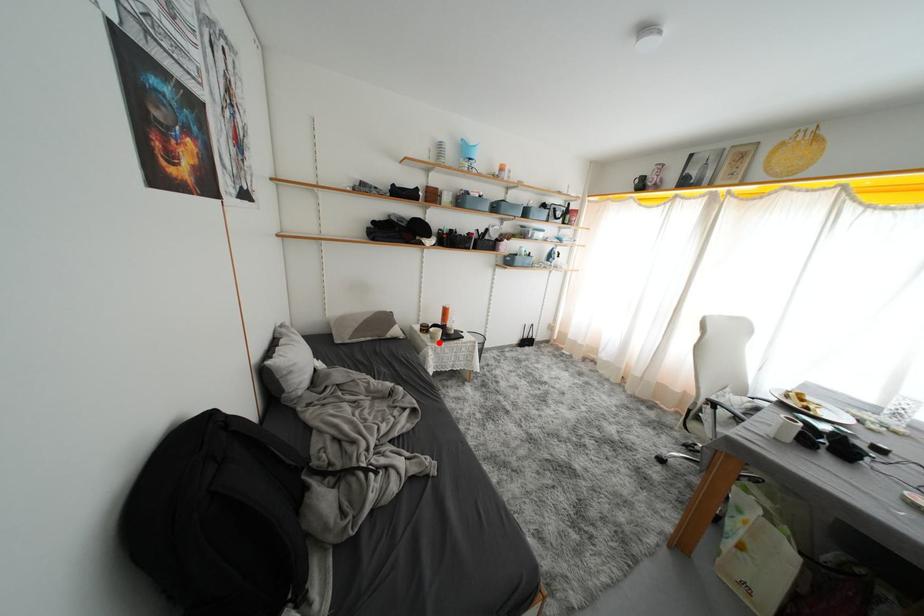
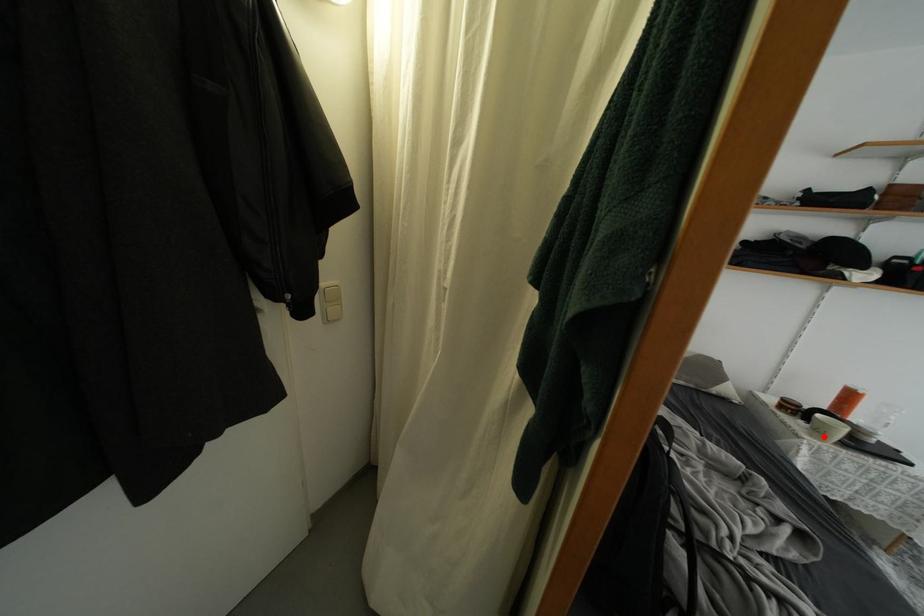
I am providing you with two images of the same scene from different viewpoints. A red point is marked on the first image and another point is marked on the second image. Is the marked point in image1 the same physical position as the marked point in image2?

Yes